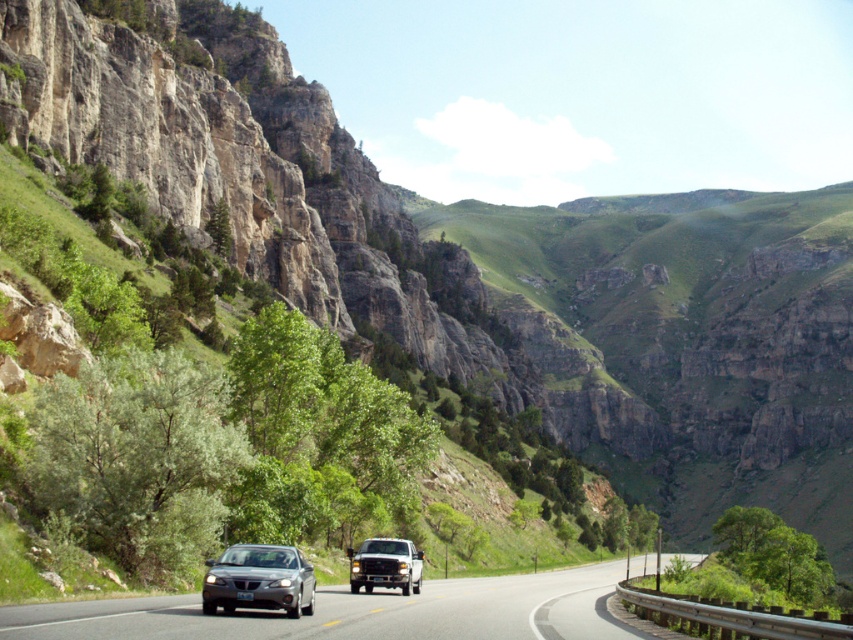
Describe the element at coordinates (358, 612) in the screenshot. I see `silver metallic car at center` at that location.

In the scene shown: Can you confirm if silver metallic car at center is positioned below satin silver sedan at center?

Yes, silver metallic car at center is below satin silver sedan at center.

Is point (419, 605) more distant than point (312, 596)?

Yes, it is.

Locate an element on the screen. Image resolution: width=853 pixels, height=640 pixels. silver metallic car at center is located at coordinates (358, 612).

Who is higher up, satin silver sedan at center or matte black truck at center?

satin silver sedan at center is above.

Between point (247, 576) and point (398, 566), which one is positioned in front?

Point (247, 576)

Who is more forward, [256,568] or [387,568]?

Positioned in front is point [256,568].

Identify the location of satin silver sedan at center. The height and width of the screenshot is (640, 853). (258, 580).

Which is more to the right, silver metallic car at center or matte black truck at center?

silver metallic car at center is more to the right.

Does point (47, 620) lie in front of point (381, 573)?

Yes.

You are a GUI agent. You are given a task and a screenshot of the screen. Output one action in this format:
    pyautogui.click(x=<x>, y=<y>)
    Task: Click on the silver metallic car at center
    The image size is (853, 640).
    Given the screenshot: What is the action you would take?
    pyautogui.click(x=358, y=612)